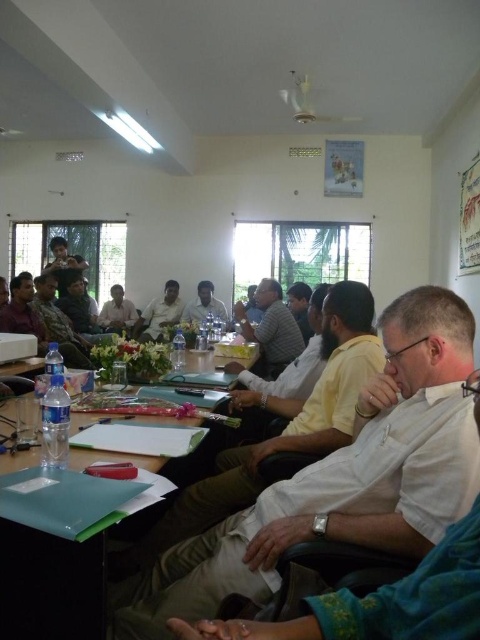
Based on the photo, you are organizing a photo shoot in the conference room and need to position two models wearing the matte gray shirt at center and the matte black shirt at center. Since the ceiling fan is present, you must ensure that neither model will be hit by the fan blades. Given the fan blades are 1.2 meters in diameter, which model should stand closer to the ceiling fan to stay safe?

The matte gray shirt at center should stand closer to the ceiling fan since it has a smaller size compared to the matte black shirt at center, reducing the risk of the fan blades hitting them.

Looking at this image, you are organizing a photo shoot and need to arrange two models wearing the matte gray shirt at center and the matte black shirt at center. The photographer wants the thinner model to stand in front to avoid blocking the view. Which shirt should be placed in front?

The matte gray shirt at center is thinner than the matte black shirt at center, so the model wearing the matte gray shirt at center should stand in front to avoid blocking the view.